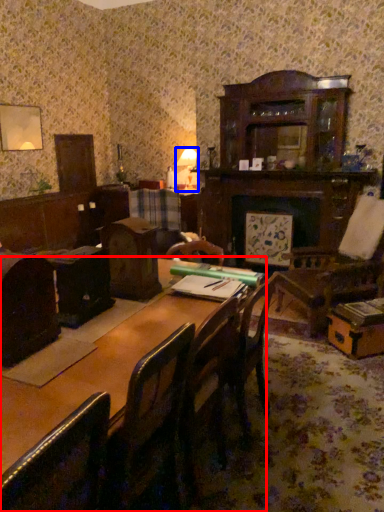
Question: Among these objects, which one is nearest to the camera, table (highlighted by a red box) or table lamp (highlighted by a blue box)?

Choices:
 (A) table
 (B) table lamp

Answer: (A)